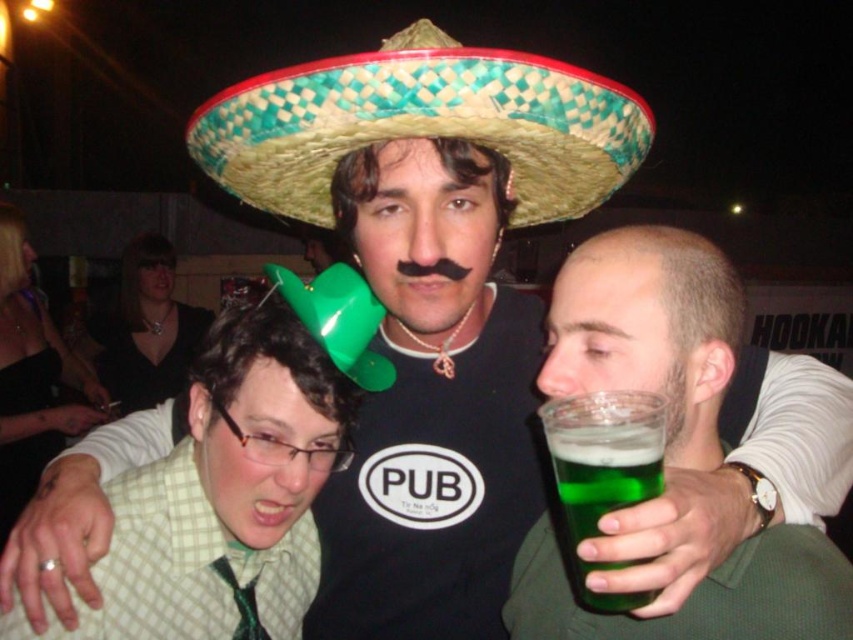
You are at a party and want to grab a drink. There is a point at coordinates point (648, 332). Where is this point located?

The point (648, 332) is on the green glass at right.

You are at a party and want to take a photo with the green matte hat at center and the green woven straw sombrero at center. Since you can only focus on one object at a time, which one should you position closer to the camera to ensure it is in focus while the other is slightly blurred?

To ensure the green matte hat at center is in focus while the green woven straw sombrero at center is blurred, position the green matte hat at center closer to the camera. Since the green matte hat at center is on the left side of the green woven straw sombrero at center, moving it closer will create depth of field where the closer object is sharp and the farther one is blurred.

You are at a party and want to hand a drink to the person wearing the green matte hat at center. You have a green glass at right in your hand. Can you reach the person without moving your feet? The average human arm length is 25 inches.

The green glass at right and green matte hat at center are 14.27 inches apart from each other. Since the distance between them is less than the average human arm length of 25 inches, you can reach the person wearing the green matte hat at center without moving your feet.